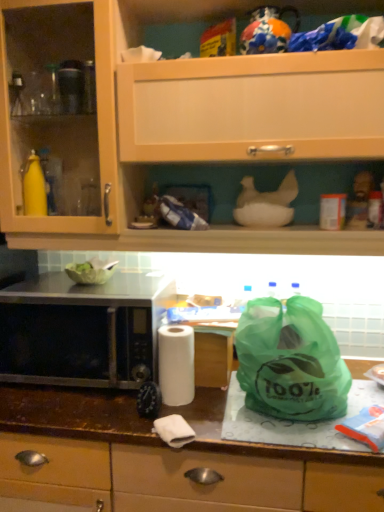
The image size is (384, 512). I want to click on free point to the right of white matte paper towel at center, so click(x=226, y=415).